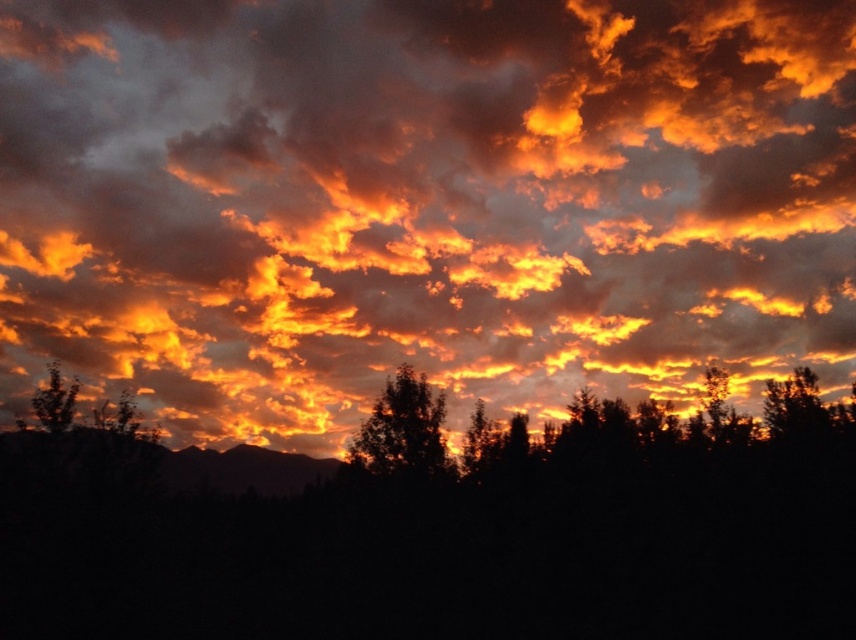
Who is positioned more to the right, silhouette tree at center or silhouette leafy tree at left?

silhouette tree at center is more to the right.

What do you see at coordinates (403, 429) in the screenshot? This screenshot has width=856, height=640. I see `silhouette tree at center` at bounding box center [403, 429].

Image resolution: width=856 pixels, height=640 pixels. I want to click on silhouette tree at center, so click(403, 429).

Measure the distance from glowing orange cloud at upper center to silhouette tree at center.

glowing orange cloud at upper center is 21.34 meters away from silhouette tree at center.

At what (x,y) coordinates should I click in order to perform the action: click on glowing orange cloud at upper center. Please return your answer as a coordinate pair (x, y). Image resolution: width=856 pixels, height=640 pixels. Looking at the image, I should click on (420, 202).

The image size is (856, 640). Describe the element at coordinates (420, 202) in the screenshot. I see `glowing orange cloud at upper center` at that location.

Based on the photo, is glowing orange cloud at upper center thinner than silhouette leafy tree at left?

In fact, glowing orange cloud at upper center might be wider than silhouette leafy tree at left.

Which is in front, point (851, 184) or point (34, 392)?

Point (34, 392) is in front.

Locate an element on the screen. glowing orange cloud at upper center is located at coordinates (420, 202).